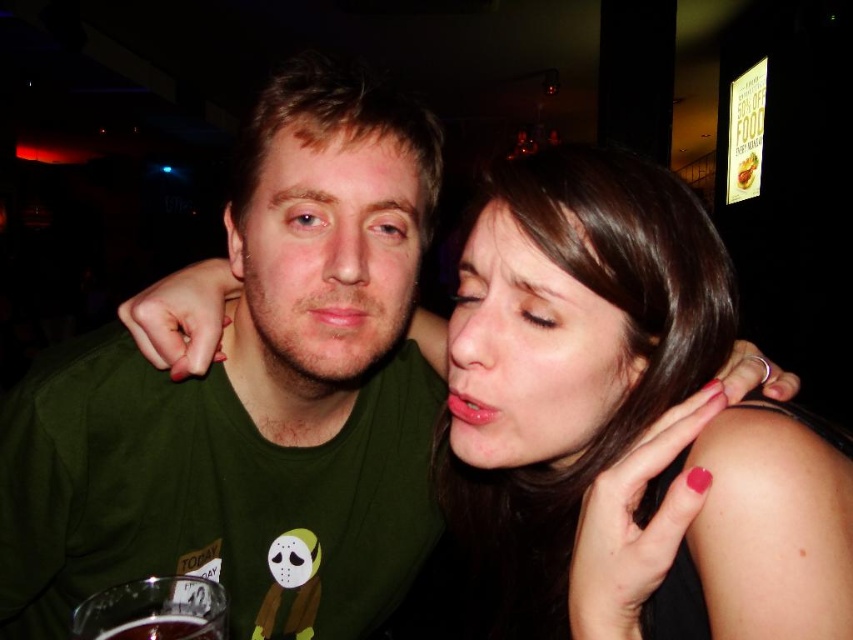
You are standing at the origin of the coordinate system in the image. You want to move to the point labeled point (691, 579). To reach there, should you walk towards the point (149, 634) or away from it?

You should walk away from point (149, 634) because point (691, 579) is behind point (149, 634) from your current position at the origin.

You are a photographer standing in front of the scene. You want to take a closeup photo of the smooth skin at center. The camera has a minimum focusing distance of 18 inches. Can you take the photo without moving closer?

The smooth skin at center is 17.46 inches away from viewer, which is within the camera minimum focusing distance of 18 inches. Therefore, you can take the photo without moving closer.

You are a photographer trying to capture a candid shot of the smooth skin at center and the dark glass at lower left. Which object is closer to the camera?

The smooth skin at center is closer to the camera than the dark glass at lower left because the dark glass at lower left is behind it.